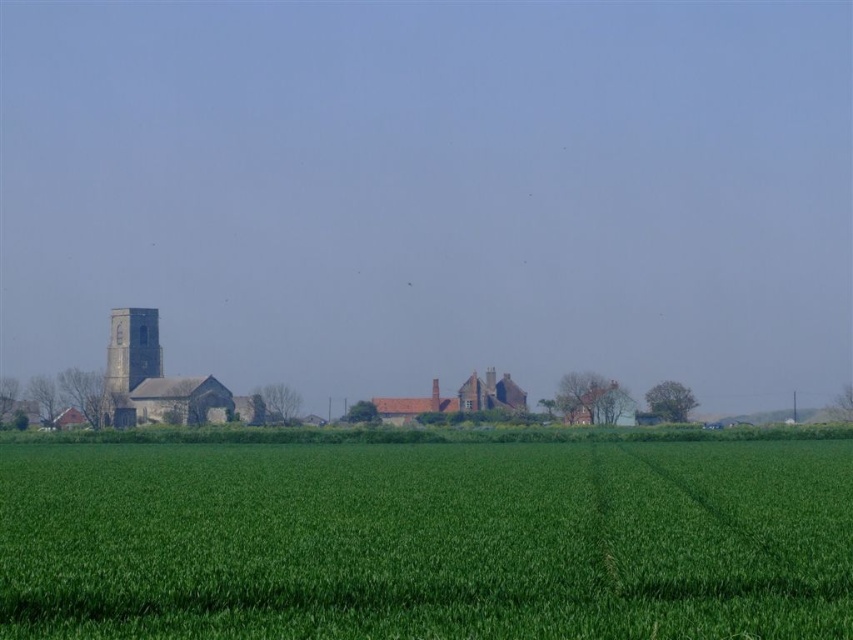
Question: Which of the following is the farthest from the observer?

Choices:
 (A) (828, 557)
 (B) (114, 321)

Answer: (B)

Question: Is green grass at center thinner than dark gray stone tower at left?

Choices:
 (A) no
 (B) yes

Answer: (A)

Question: From the image, what is the correct spatial relationship of green grass at center in relation to dark gray stone tower at left?

Choices:
 (A) above
 (B) below

Answer: (B)

Question: Can you confirm if green grass at center is bigger than dark gray stone tower at left?

Choices:
 (A) yes
 (B) no

Answer: (A)